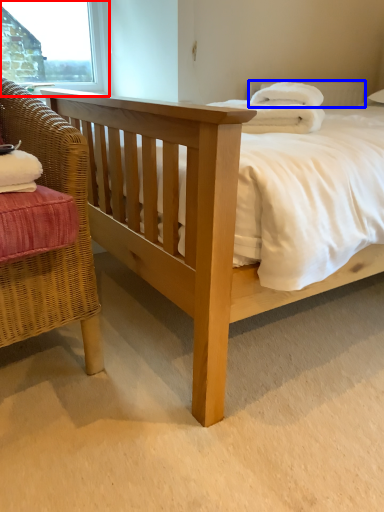
Question: Among these objects, which one is farthest to the camera, window frame (highlighted by a red box) or pillow (highlighted by a blue box)?

Choices:
 (A) window frame
 (B) pillow

Answer: (A)